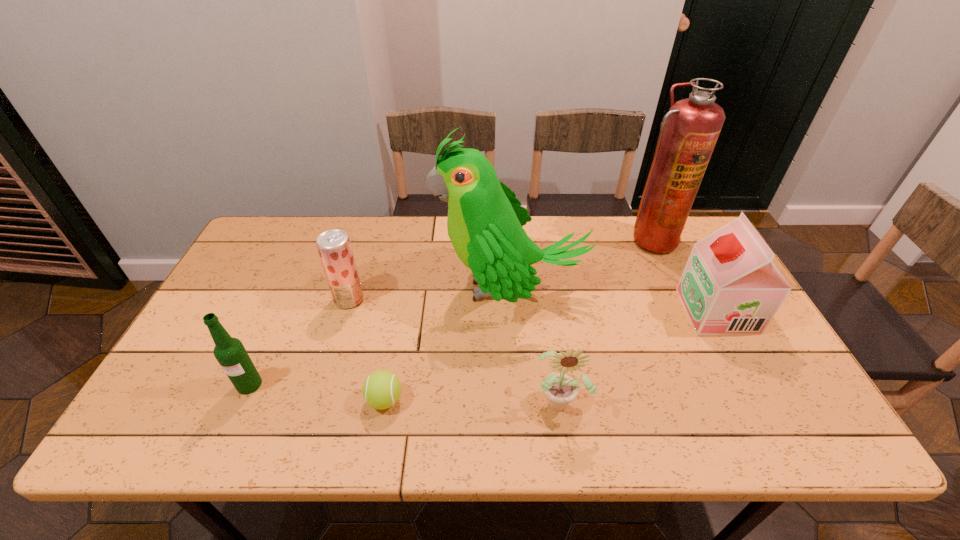
Locate an element on the screen. The image size is (960, 540). blank space at the far right corner is located at coordinates (689, 235).

Image resolution: width=960 pixels, height=540 pixels. In order to click on vacant area at the near right corner of the desktop in this screenshot , I will do `click(776, 443)`.

Where is `free area in between the soya milk and the sunflower`? This screenshot has width=960, height=540. free area in between the soya milk and the sunflower is located at coordinates (638, 356).

Where is `free space that is in between the beer bottle and the sunflower`? Image resolution: width=960 pixels, height=540 pixels. free space that is in between the beer bottle and the sunflower is located at coordinates (405, 393).

Locate an element on the screen. vacant area that lies between the sunflower and the third object from left to right is located at coordinates (472, 401).

Find the location of a particular element. This screenshot has width=960, height=540. vacant area that lies between the parakeet and the soya milk is located at coordinates (613, 300).

I want to click on free area in between the fruit juice and the sunflower, so click(x=455, y=350).

You are a GUI agent. You are given a task and a screenshot of the screen. Output one action in this format:
    pyautogui.click(x=<x>, y=<y>)
    Task: Click on the free spot between the sunflower and the soya milk
    
    Given the screenshot: What is the action you would take?
    pyautogui.click(x=638, y=356)

This screenshot has height=540, width=960. Find the location of `the fourth closest object relative to the fire extinguisher`. the fourth closest object relative to the fire extinguisher is located at coordinates (381, 390).

At what (x,y) coordinates should I click in order to perform the action: click on the fifth closest object to the sunflower. Please return your answer as a coordinate pair (x, y). The width and height of the screenshot is (960, 540). Looking at the image, I should click on (689, 131).